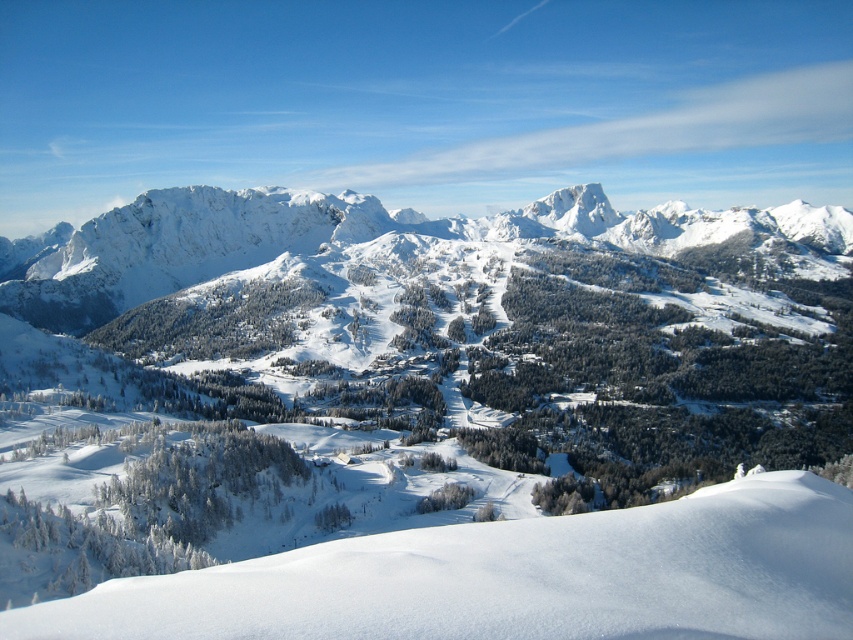
You are a skier planning to descend the slope at point (517, 577). Based on the scene description, what type of terrain will you encounter there?

The terrain at point (517, 577) is a white snow ski slope at lower left, which is a gentle slope covered in pristine white snow, suitable for skiing.